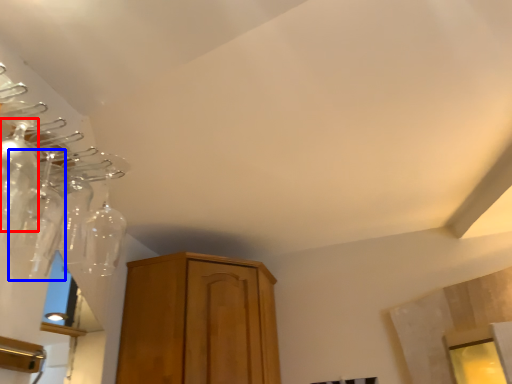
Question: Which object appears closest to the camera in this image, glass bottle (highlighted by a red box) or glass bottle (highlighted by a blue box)?

Choices:
 (A) glass bottle
 (B) glass bottle

Answer: (A)